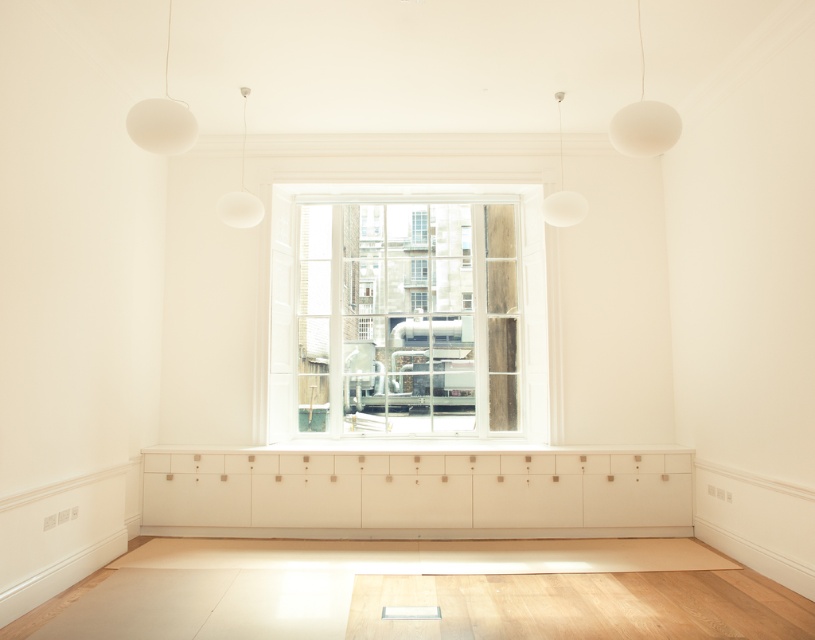
Who is positioned more to the right, white matte cabinet at center or white matte globe at upper center?

white matte globe at upper center is more to the right.

Which is in front, point (632, 512) or point (554, 212)?

Point (554, 212) is more forward.

Locate an element on the screen. This screenshot has width=815, height=640. white matte cabinet at center is located at coordinates (417, 493).

Is white matte cabinet at center shorter than white matte sphere at upper right?

Incorrect, white matte cabinet at center's height does not fall short of white matte sphere at upper right's.

Where is `white matte cabinet at center`? white matte cabinet at center is located at coordinates (417, 493).

Can you confirm if clear glass window at center is taller than white matte globe at upper center?

Indeed, clear glass window at center has a greater height compared to white matte globe at upper center.

Does point (291, 266) come in front of point (582, 196)?

No, (291, 266) is behind (582, 196).

Is point (439, 276) positioned after point (576, 195)?

Yes, it is behind point (576, 195).

Locate an element on the screen. clear glass window at center is located at coordinates (408, 314).